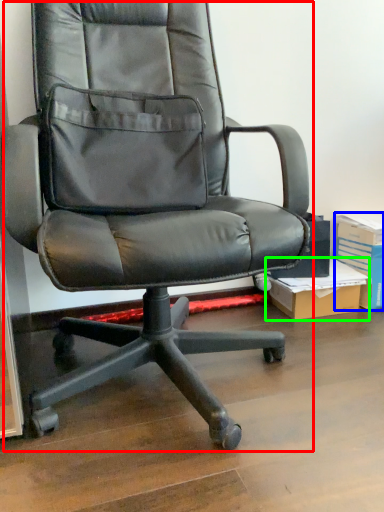
Question: Which object is positioned farthest from chair (highlighted by a red box)? Select from paperback book (highlighted by a blue box) and cardboard box (highlighted by a green box).

Choices:
 (A) paperback book
 (B) cardboard box

Answer: (A)